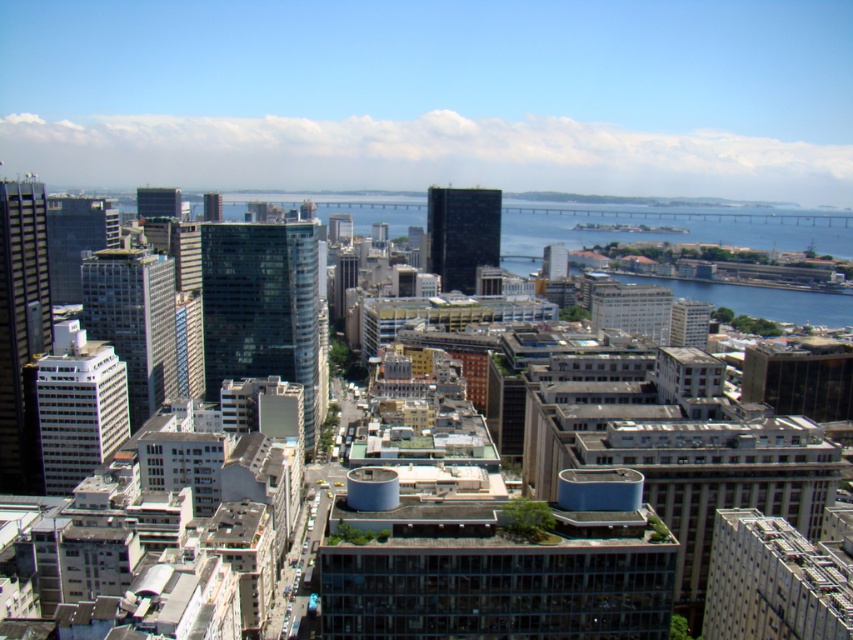
Question: Estimate the real-world distances between objects in this image. Which object is farther from the transparent glass water at center?

Choices:
 (A) glassy blue skyscraper at upper center
 (B) glassy blue skyscraper at center
 (C) matte glass tower at upper left
 (D) white glass building at center-left

Answer: (D)

Question: Is glassy blue skyscraper at center to the right of matte glass skyscraper at center from the viewer's perspective?

Choices:
 (A) yes
 (B) no

Answer: (B)

Question: Does white glossy building at left come behind matte glass skyscraper at center?

Choices:
 (A) no
 (B) yes

Answer: (A)

Question: Which object appears closest to the camera in this image?

Choices:
 (A) glassy blue skyscraper at center
 (B) glassy blue skyscraper at upper center

Answer: (A)

Question: Does white glass building at center-left appear on the right side of glassy blue skyscraper at upper center?

Choices:
 (A) yes
 (B) no

Answer: (A)

Question: Which object appears closest to the camera in this image?

Choices:
 (A) transparent glass water at center
 (B) white glass building at center-left

Answer: (B)